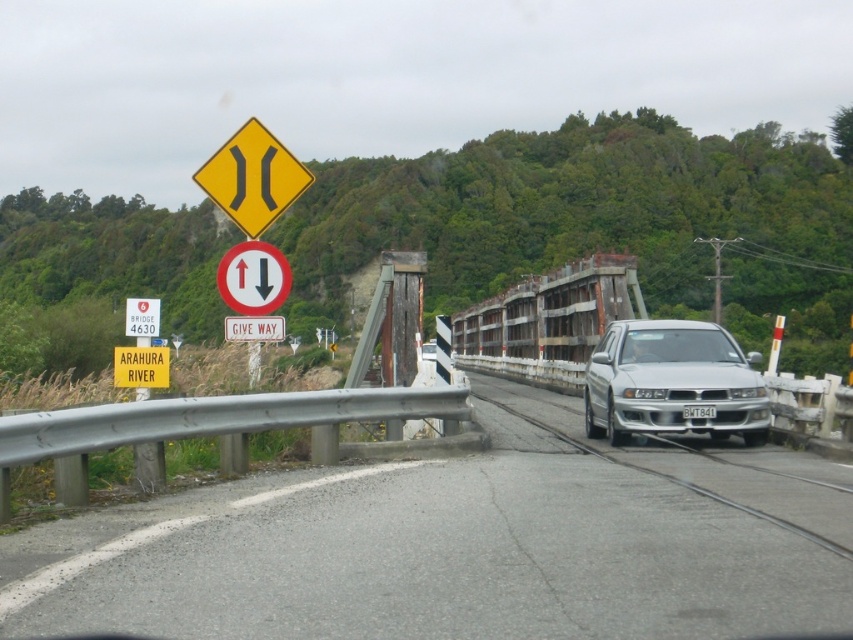
Could you measure the distance between yellow plastic speed limit sign at upper left and white plastic license plate at center?

The distance of yellow plastic speed limit sign at upper left from white plastic license plate at center is 8.14 meters.

Based on the photo, which is above, yellow plastic speed limit sign at upper left or white plastic license plate at center?

Positioned higher is yellow plastic speed limit sign at upper left.

Measure the distance between yellow plastic speed limit sign at upper left and camera.

yellow plastic speed limit sign at upper left and camera are 35.09 feet apart.

At what (x,y) coordinates should I click in order to perform the action: click on yellow plastic speed limit sign at upper left. Please return your answer as a coordinate pair (x, y). The width and height of the screenshot is (853, 640). Looking at the image, I should click on (142, 317).

What do you see at coordinates (672, 381) in the screenshot? This screenshot has height=640, width=853. I see `silver metallic sedan at center` at bounding box center [672, 381].

Identify the location of silver metallic sedan at center. (672, 381).

Does gray asphalt road at center have a lesser height compared to white plastic license plate at center?

No, gray asphalt road at center is not shorter than white plastic license plate at center.

Consider the image. Is gray asphalt road at center to the right of white plastic license plate at center from the viewer's perspective?

In fact, gray asphalt road at center is to the left of white plastic license plate at center.

Is point (596, 477) farther from camera compared to point (712, 404)?

That is False.

Locate an element on the screen. This screenshot has height=640, width=853. gray asphalt road at center is located at coordinates (466, 545).